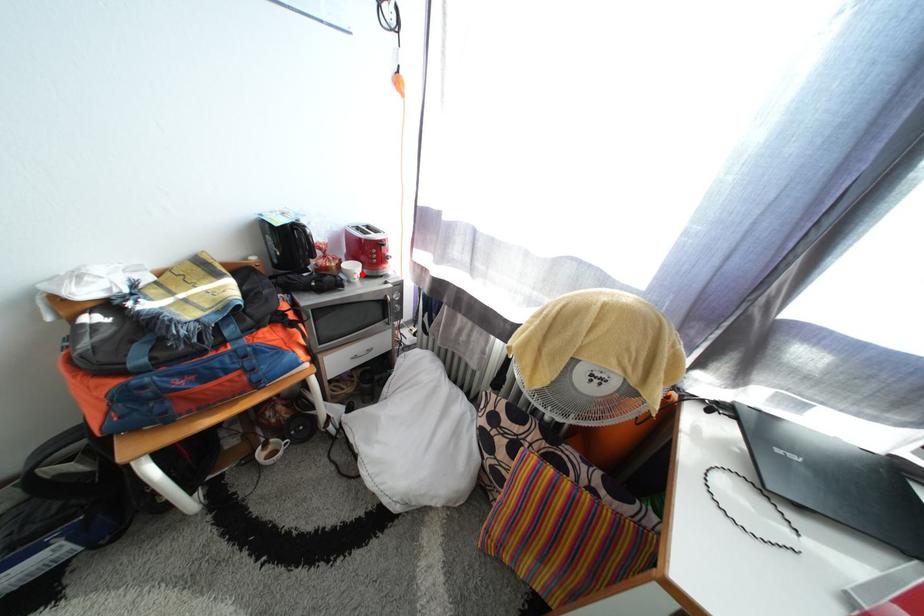
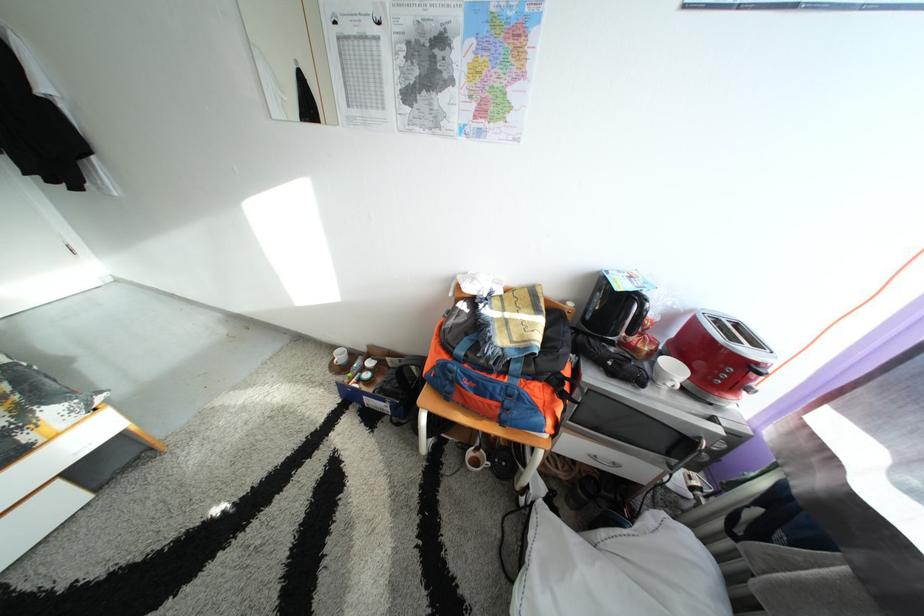
In the second image, find the point that corresponds to the highlighted location in the first image.

(683, 376)